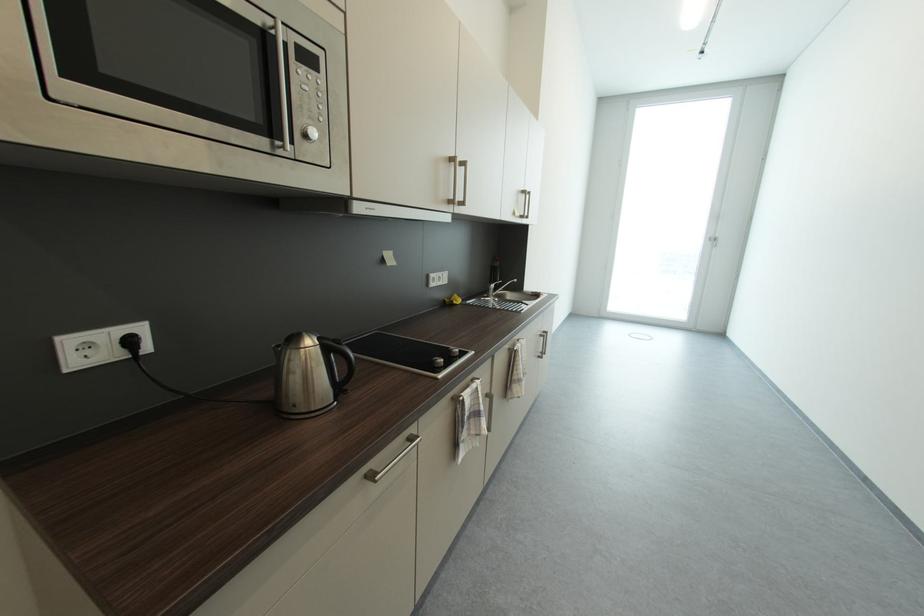
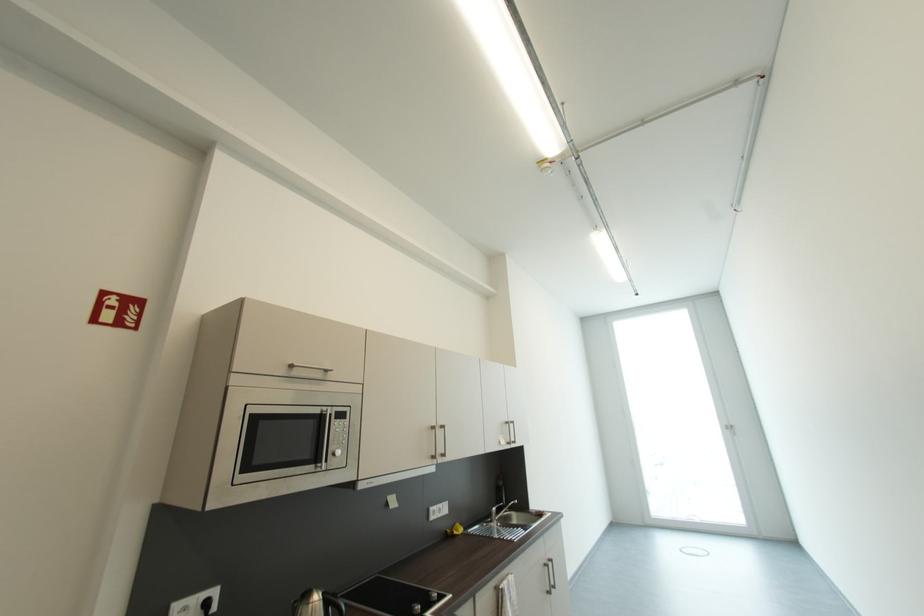
Where in the second image is the point corresponding to point (266, 28) from the first image?

(325, 413)